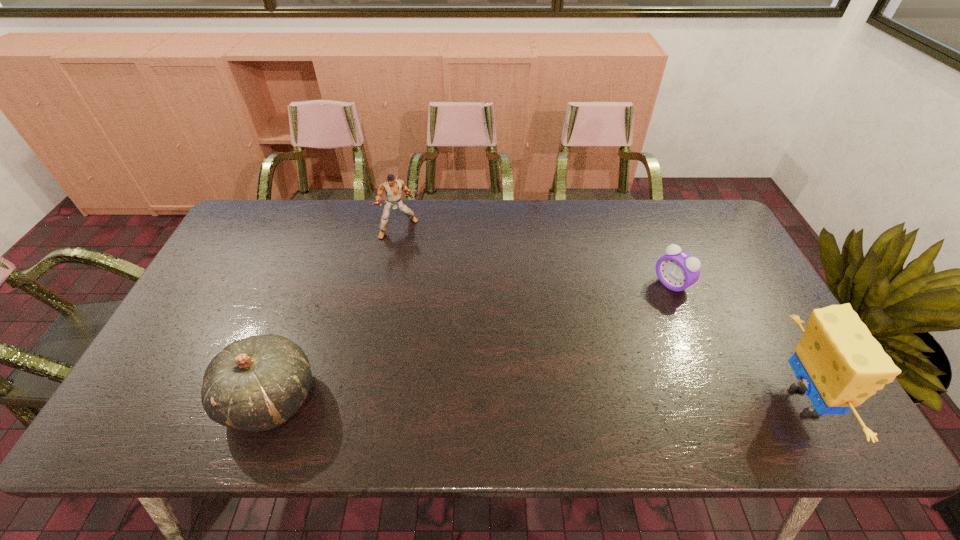
Where is `vacant space at the far edge of the desktop`? The height and width of the screenshot is (540, 960). vacant space at the far edge of the desktop is located at coordinates (440, 227).

Where is `free region at the near edge`? free region at the near edge is located at coordinates (675, 394).

Image resolution: width=960 pixels, height=540 pixels. I want to click on vacant space at the left edge, so click(x=272, y=259).

This screenshot has width=960, height=540. I want to click on vacant space at the right edge of the desktop, so click(743, 316).

In the image, there is a desktop. Identify the location of vacant space at the far left corner. The height and width of the screenshot is (540, 960). (275, 215).

At what (x,y) coordinates should I click in order to perform the action: click on vacant region at the near left corner. Please return your answer as a coordinate pair (x, y). This screenshot has width=960, height=540. Looking at the image, I should click on (183, 397).

Image resolution: width=960 pixels, height=540 pixels. In the image, there is a desktop. In order to click on vacant space at the far right corner in this screenshot , I will do `click(718, 224)`.

Where is `vacant space in between the second tallest object and the leftmost object`? Image resolution: width=960 pixels, height=540 pixels. vacant space in between the second tallest object and the leftmost object is located at coordinates (334, 313).

Where is `empty space that is in between the third tallest object and the tallest object`? This screenshot has width=960, height=540. empty space that is in between the third tallest object and the tallest object is located at coordinates (536, 400).

This screenshot has width=960, height=540. I want to click on free space between the third nearest object and the gourd, so click(470, 341).